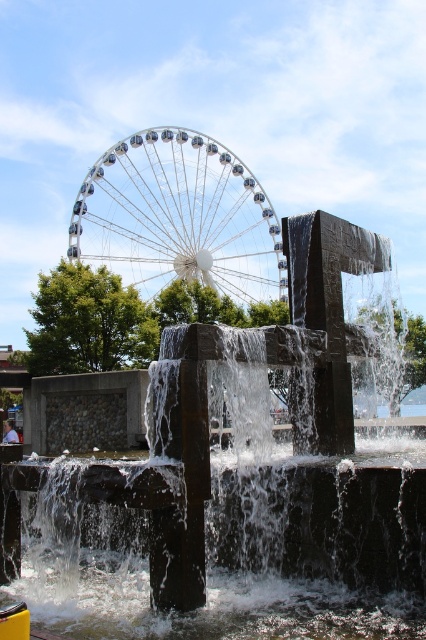
Is clear water at center bigger than shiny metallic ferris wheel at upper center?

No.

Does clear water at center appear on the right side of shiny metallic ferris wheel at upper center?

Indeed, clear water at center is positioned on the right side of shiny metallic ferris wheel at upper center.

This screenshot has height=640, width=426. I want to click on clear water at center, so click(244, 552).

The height and width of the screenshot is (640, 426). In order to click on clear water at center in this screenshot , I will do `click(244, 552)`.